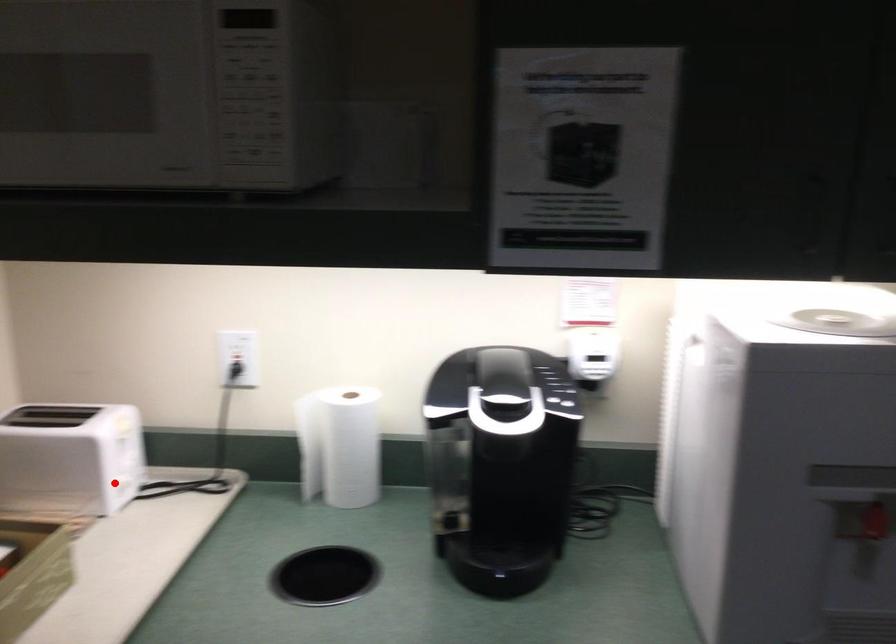
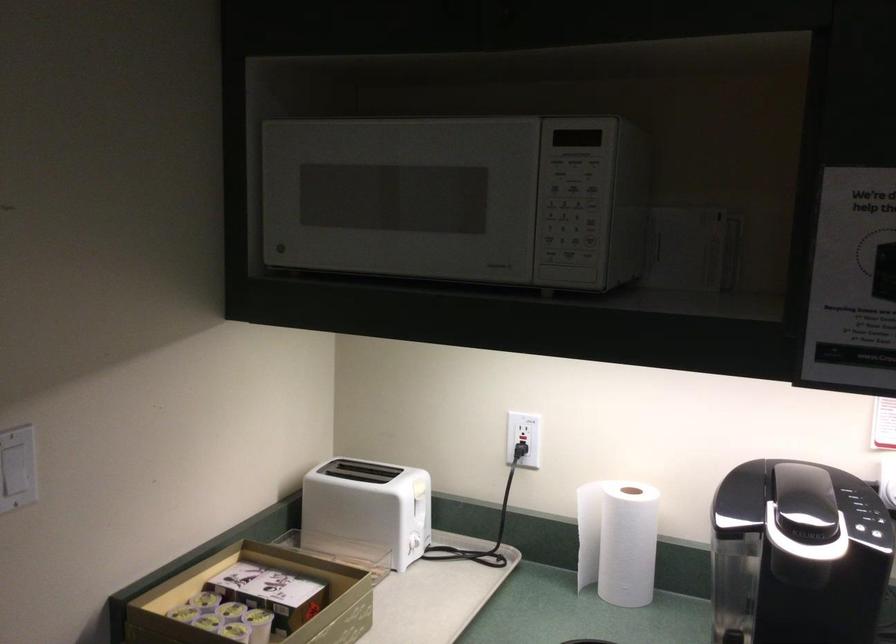
Find the pixel in the second image that matches the highlighted location in the first image.

(408, 542)